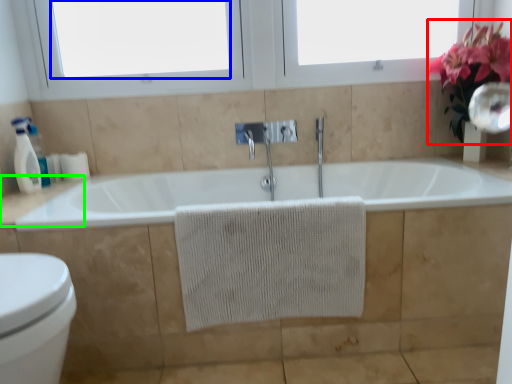
Question: Which object is the farthest from floral arrangement (highlighted by a red box)? Choose among these: window screen (highlighted by a blue box) or counter top (highlighted by a green box).

Choices:
 (A) window screen
 (B) counter top

Answer: (B)